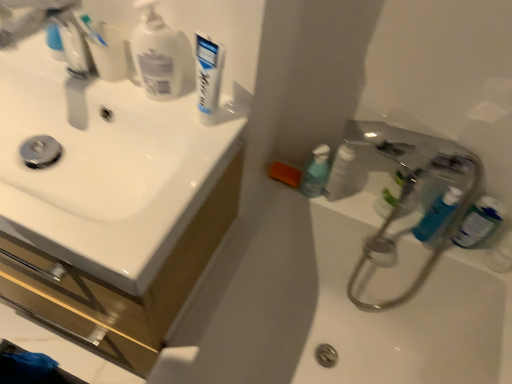
This screenshot has height=384, width=512. I want to click on space that is in front of white matte pump bottle at upper left, so click(163, 171).